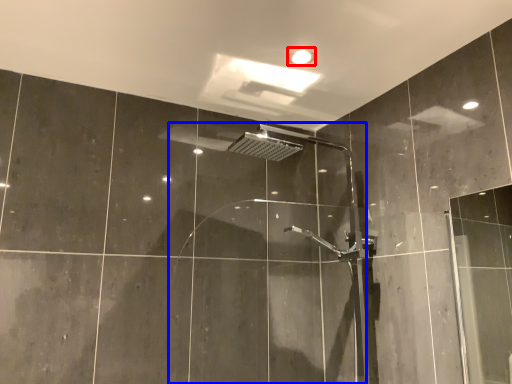
Question: Which object is further to the camera taking this photo, light fixture (highlighted by a red box) or screen door (highlighted by a blue box)?

Choices:
 (A) light fixture
 (B) screen door

Answer: (A)